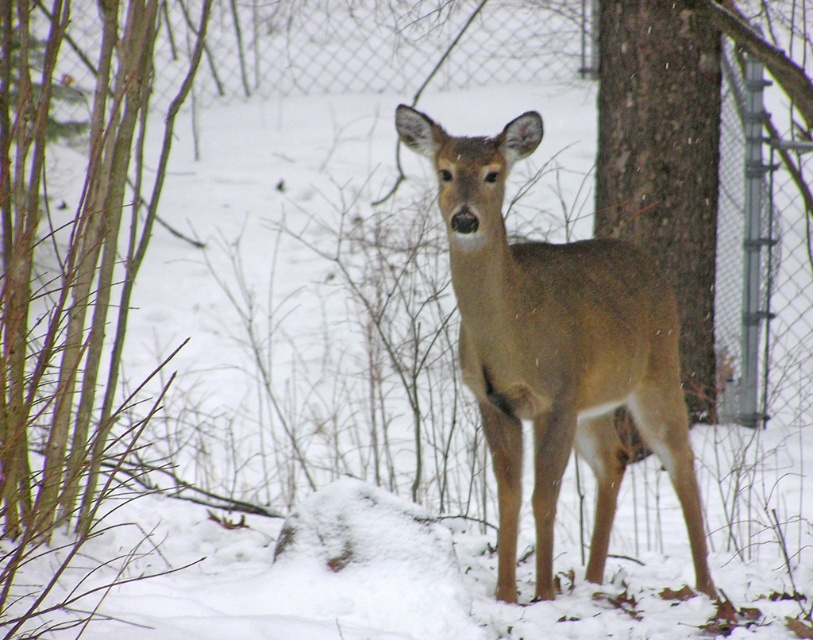
From the picture: Can you confirm if brown matte/deer at center is shorter than brown rough bark tree at center?

Yes.

Is brown matte/deer at center positioned before brown rough bark tree at center?

Yes, brown matte/deer at center is in front of brown rough bark tree at center.

Where is `brown matte/deer at center`? The width and height of the screenshot is (813, 640). brown matte/deer at center is located at coordinates (555, 348).